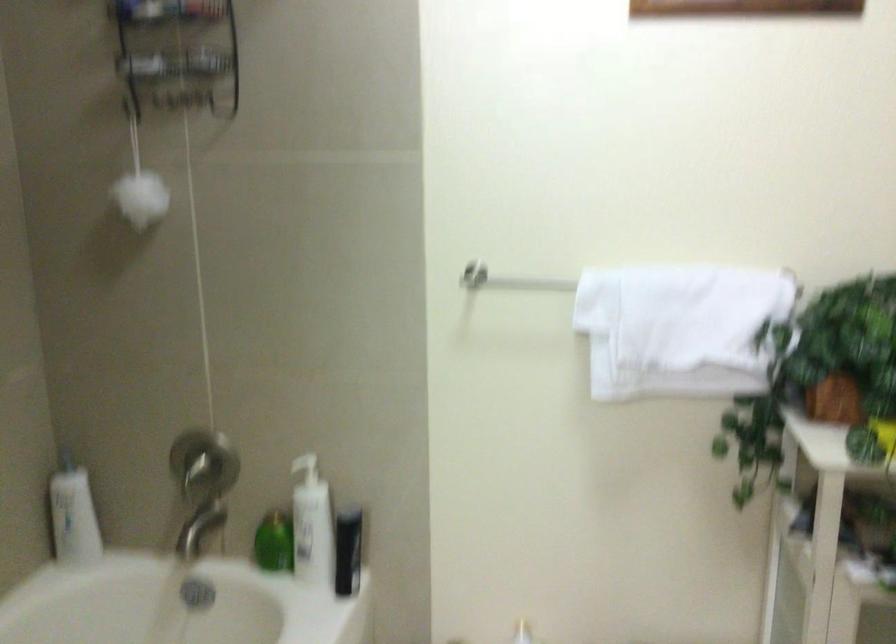
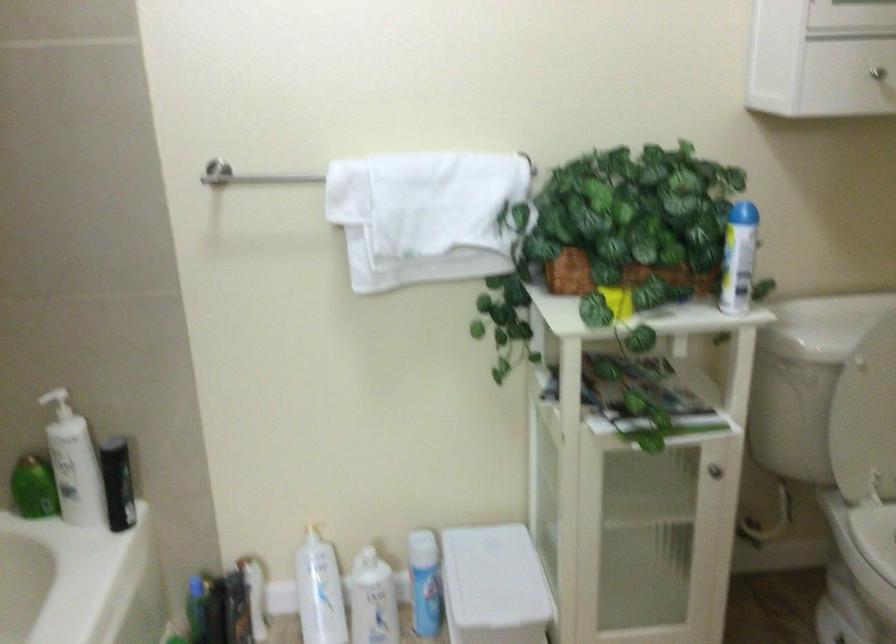
The point at (x=672, y=324) is marked in the first image. Where is the corresponding point in the second image?

(424, 214)